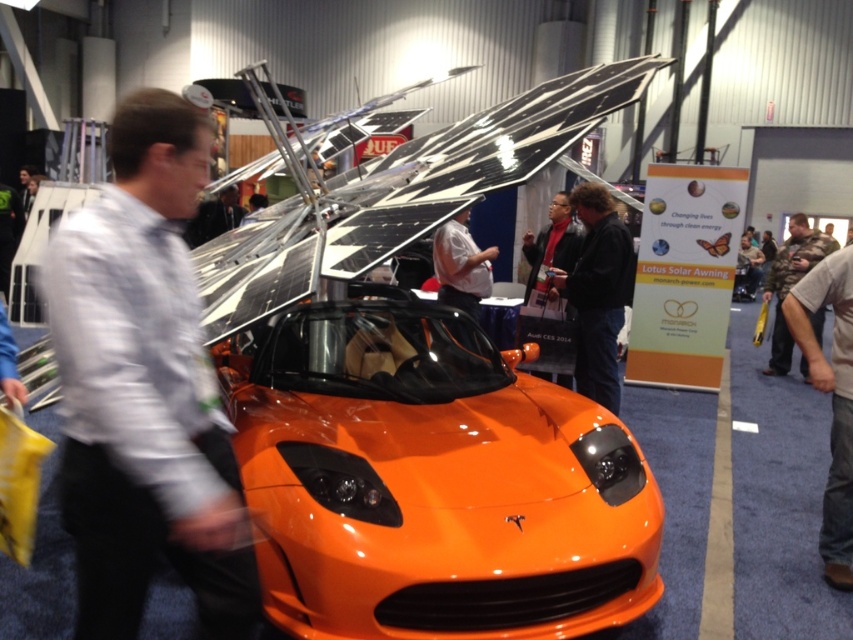
Identify the location of glossy orange sports car at center. (431, 481).

Where is `glossy orange sports car at center`? glossy orange sports car at center is located at coordinates (431, 481).

Does dark brown leather jacket at center have a greater width compared to matte black jacket at center?

Indeed, dark brown leather jacket at center has a greater width compared to matte black jacket at center.

Between dark brown leather jacket at center and matte black jacket at center, which one is positioned higher?

matte black jacket at center is above.

Between point (579, 392) and point (553, 220), which one is positioned behind?

Point (553, 220)

This screenshot has height=640, width=853. I want to click on dark brown leather jacket at center, so click(598, 292).

How far apart are white shirt at left and dark brown leather jacket at center?

The distance of white shirt at left from dark brown leather jacket at center is 3.47 meters.

The height and width of the screenshot is (640, 853). What do you see at coordinates (144, 387) in the screenshot?
I see `white shirt at left` at bounding box center [144, 387].

Locate an element on the screen. white shirt at left is located at coordinates (144, 387).